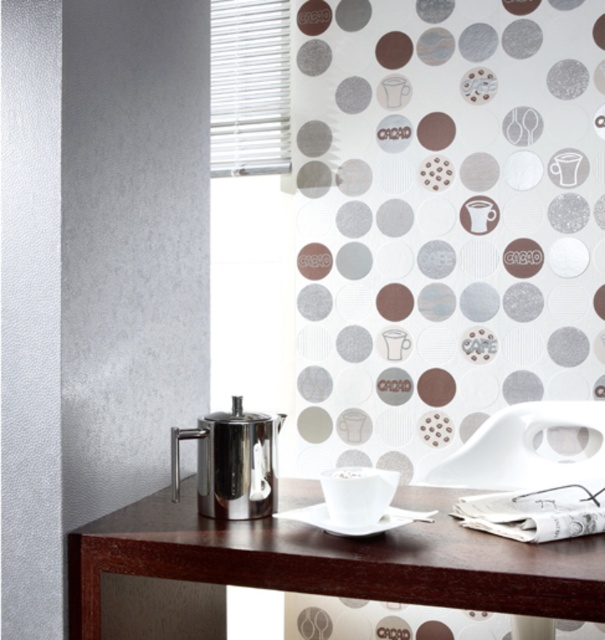
Can you confirm if shiny dark wood table at center is positioned to the right of polished stainless steel teapot at left?

Correct, you'll find shiny dark wood table at center to the right of polished stainless steel teapot at left.

The width and height of the screenshot is (605, 640). I want to click on shiny dark wood table at center, so click(310, 566).

You are a GUI agent. You are given a task and a screenshot of the screen. Output one action in this format:
    pyautogui.click(x=<x>, y=<y>)
    Task: Click on the shiny dark wood table at center
    This screenshot has width=605, height=640.
    Given the screenshot: What is the action you would take?
    pyautogui.click(x=310, y=566)